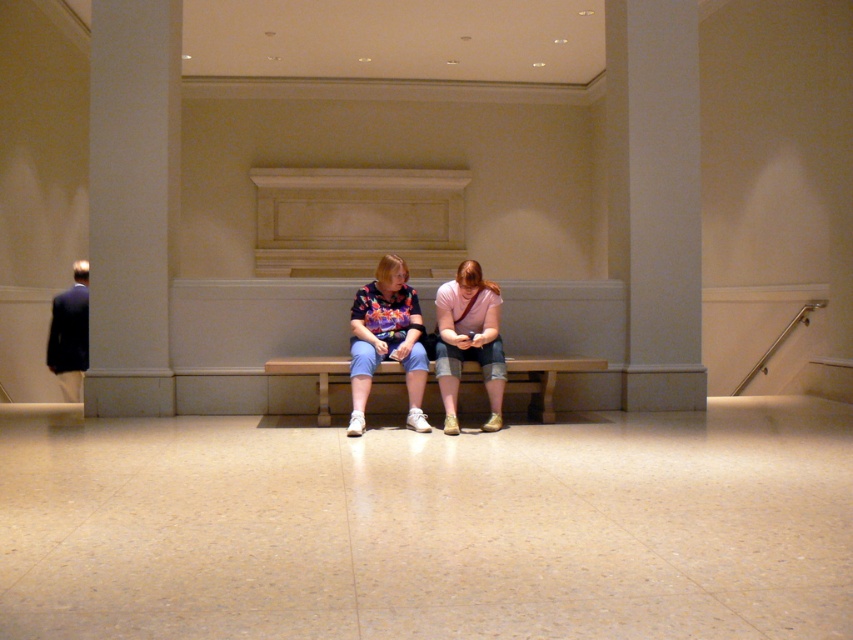
Can you confirm if white marble pillar at left is smaller than matte pink shirt at center?

Incorrect, white marble pillar at left is not smaller in size than matte pink shirt at center.

Where is `white marble pillar at left`? This screenshot has height=640, width=853. white marble pillar at left is located at coordinates 132,204.

Locate an element on the screen. The width and height of the screenshot is (853, 640). white marble pillar at left is located at coordinates (132, 204).

This screenshot has width=853, height=640. Identify the location of floral fabric shirt at center. coord(469,337).

Who is taller, floral fabric shirt at center or wooden bench at center?

Standing taller between the two is floral fabric shirt at center.

Is point (384, 305) closer to viewer compared to point (544, 365)?

No, it is not.

Identify the location of floral fabric shirt at center. This screenshot has height=640, width=853. pyautogui.click(x=469, y=337).

Which is below, white smooth pillar at center or wooden bench at center?

wooden bench at center

Who is more forward, [669,81] or [316,371]?

Point [316,371]

I want to click on white smooth pillar at center, so click(x=656, y=196).